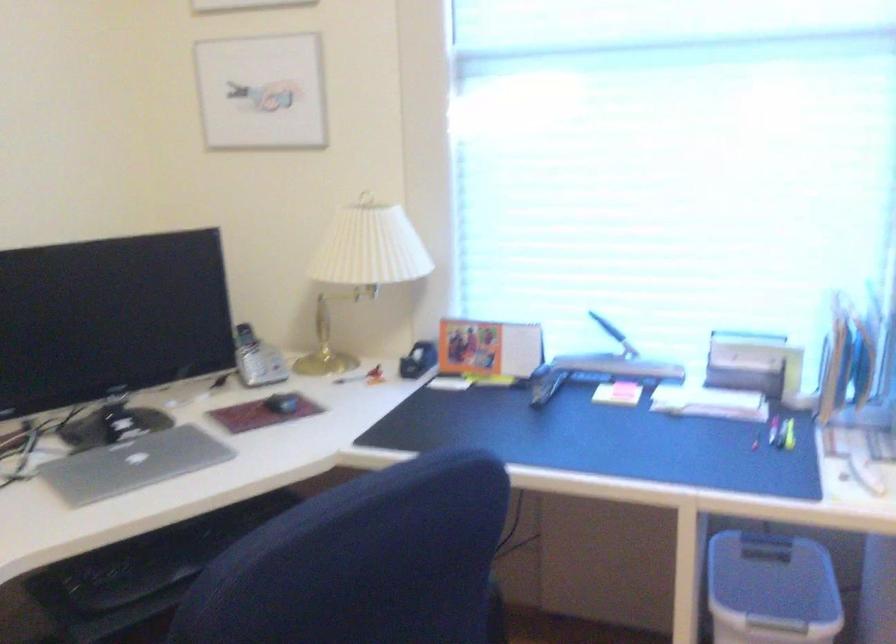
Locate an element on the screen. storage bin lid is located at coordinates (771, 589).